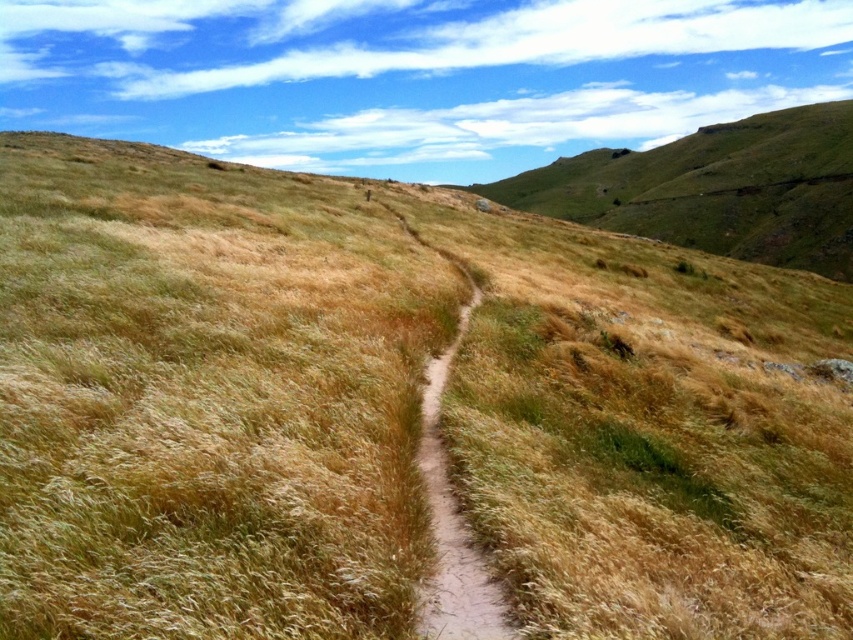
Looking at this image, you are a hiker standing at the start of the brown dirt path at center. You want to reach the green grassy hillside at upper right. Which direction should you head relative to the path?

The green grassy hillside at upper right is to the right of the brown dirt path at center, so you should head to the right of the path to reach it.

You are planning to take a photo of the brown dirt path at center and the green grassy hillside at upper right. Which object should you focus on first if you want to capture both in a single frame without moving the camera?

You should focus on the green grassy hillside at upper right first because it is larger than the brown dirt path at center, ensuring it fits well within the frame before adjusting for the smaller path.